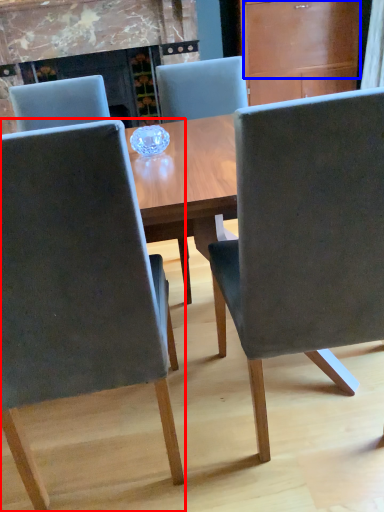
Question: Which of the following is the closest to the observer, chair (highlighted by a red box) or drawer (highlighted by a blue box)?

Choices:
 (A) chair
 (B) drawer

Answer: (A)